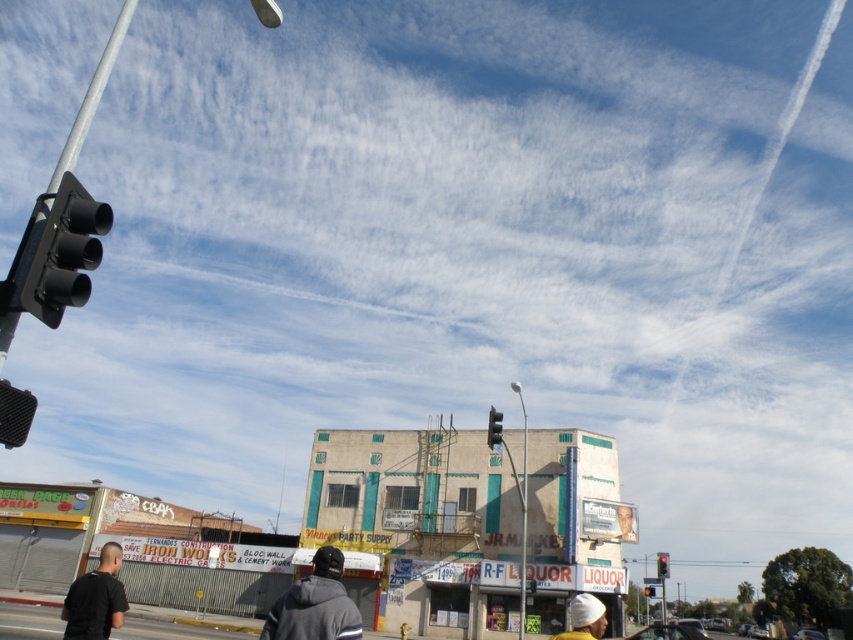
Who is taller, red glass traffic light at upper center or red glass traffic light at upper left?

Standing taller between the two is red glass traffic light at upper center.

Which of these two, red glass traffic light at upper center or red glass traffic light at upper left, stands shorter?

red glass traffic light at upper left is shorter.

Which is in front, point (666, 568) or point (646, 593)?

Positioned in front is point (666, 568).

Locate an element on the screen. red glass traffic light at upper center is located at coordinates (662, 564).

Which is in front, point (61, 618) or point (659, 576)?

Point (61, 618) is more forward.

Is point (113, 554) farther from camera compared to point (662, 561)?

No, it is in front of (662, 561).

The height and width of the screenshot is (640, 853). Describe the element at coordinates (96, 598) in the screenshot. I see `dark gray hoodie at lower left` at that location.

Identify the location of dark gray hoodie at lower left. This screenshot has height=640, width=853. (96, 598).

Looking at this image, is matte black traffic light at left to the left of white knit cap at center from the viewer's perspective?

Correct, you'll find matte black traffic light at left to the left of white knit cap at center.

Is matte black traffic light at left positioned in front of white knit cap at center?

Yes, it is in front of white knit cap at center.

The width and height of the screenshot is (853, 640). I want to click on matte black traffic light at left, so click(x=65, y=252).